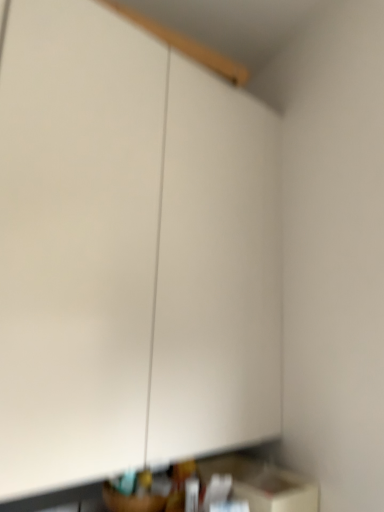
What are the coordinates of `white matte cupboard at center` in the screenshot? It's located at (129, 254).

What do you see at coordinates (129, 254) in the screenshot?
I see `white matte cupboard at center` at bounding box center [129, 254].

You are a GUI agent. You are given a task and a screenshot of the screen. Output one action in this format:
    pyautogui.click(x=<x>, y=<y>)
    Task: Click on the white matte cupboard at center
    Image resolution: width=384 pixels, height=512 pixels.
    Given the screenshot: What is the action you would take?
    pyautogui.click(x=129, y=254)